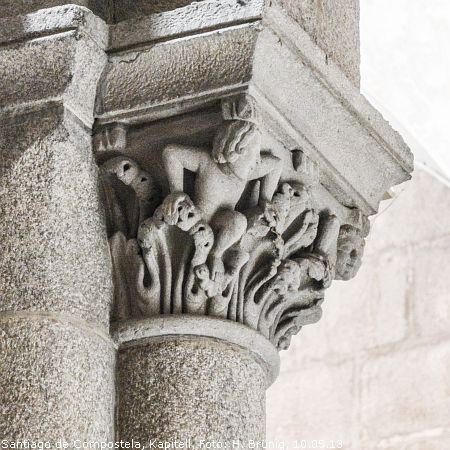
You are a GUI agent. You are given a task and a screenshot of the screen. Output one action in this format:
    pyautogui.click(x=<x>, y=<y>)
    Task: Click on the brick wall
    
    Given the screenshot: What is the action you would take?
    pyautogui.click(x=407, y=364)